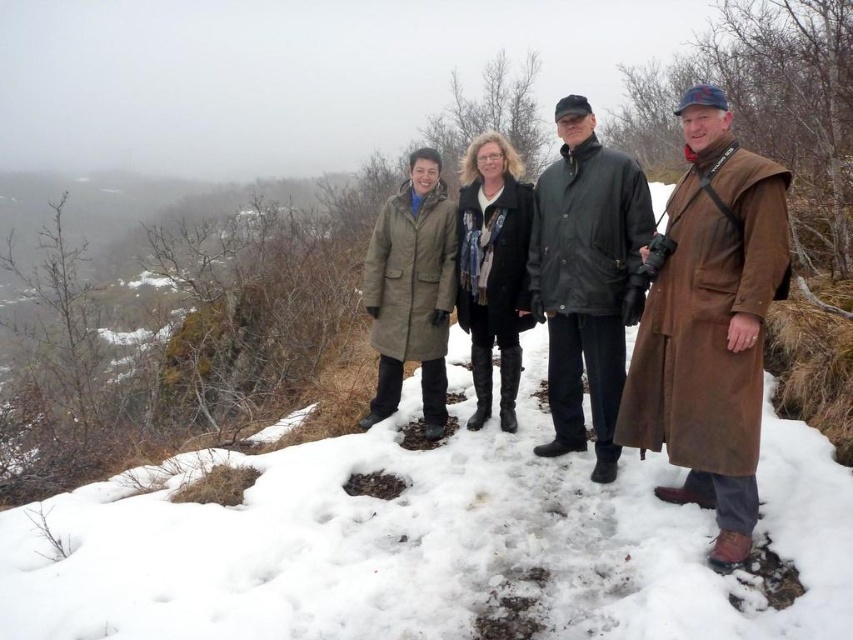
Which is more to the right, white powdery snow at center or dark green leather jacket at center?

dark green leather jacket at center

Is point (108, 636) behind point (624, 189)?

No, it is in front of (624, 189).

Find the location of a particular element. Image resolution: width=853 pixels, height=640 pixels. white powdery snow at center is located at coordinates (422, 545).

Which of these two, matte brown coat at center or brown leather coat at right, stands shorter?

With less height is brown leather coat at right.

Which is in front, point (635, 426) or point (706, 470)?

Point (706, 470) is in front.

The width and height of the screenshot is (853, 640). I want to click on matte brown coat at center, so click(709, 321).

Is brown leather coat at right smaller than dark green leather jacket at center?

Yes, brown leather coat at right is smaller than dark green leather jacket at center.

The width and height of the screenshot is (853, 640). Describe the element at coordinates (709, 321) in the screenshot. I see `brown leather coat at right` at that location.

Is point (639, 412) closer to camera compared to point (630, 248)?

Yes, point (639, 412) is in front of point (630, 248).

I want to click on brown leather coat at right, so click(x=709, y=321).